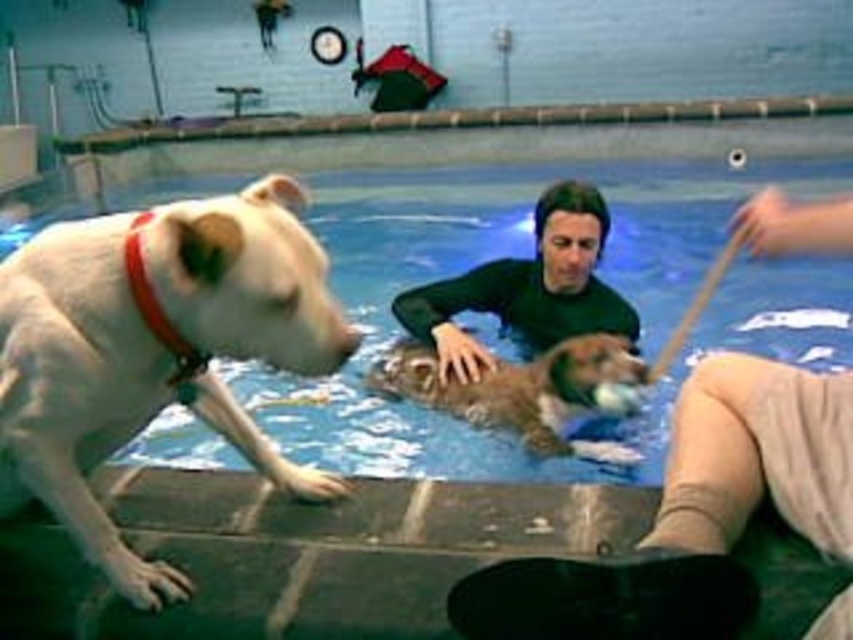
You are a swimmer planning to enter the pool. You see the white matte dog at left and the dark green wetsuit at center. Which object is closer to the pool edge?

The white matte dog at left is closer to the pool edge because it is positioned below the dark green wetsuit at center, indicating it is lower and nearer to the edge.

You are a lifeguard assessing the pool area. You notice the dark green wetsuit at center and the brown furry dog at center. Which object is wider?

The dark green wetsuit at center is wider than the brown furry dog at center.